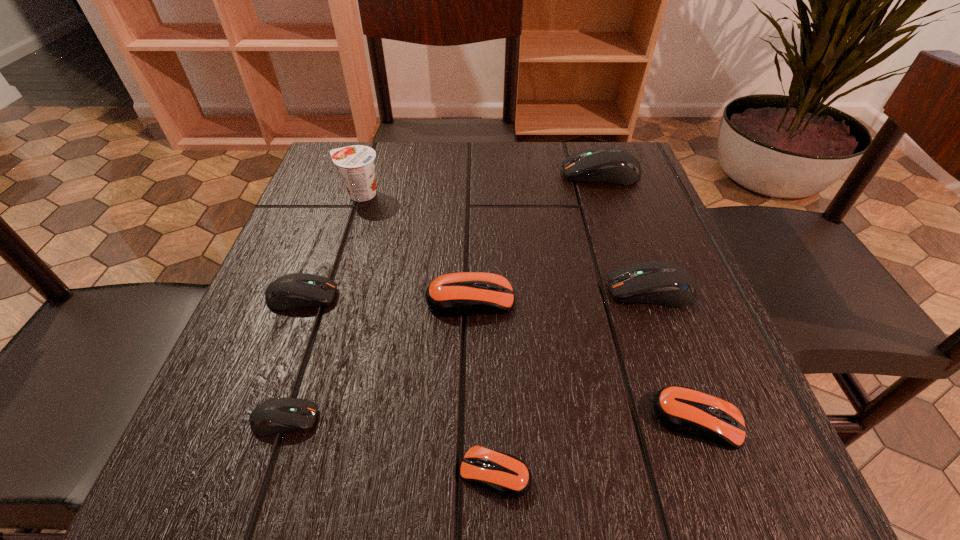
Find the location of a particular element. This screenshot has height=540, width=960. free space located 0.080m on the left of the second smallest orange computer mouse is located at coordinates (594, 420).

The image size is (960, 540). Identify the location of vacant space located 0.300m on the button of the smallest dark computer equipment. (539, 419).

The width and height of the screenshot is (960, 540). What are the coordinates of `vacant area located on the back of the shortest object` in the screenshot? It's located at pyautogui.click(x=493, y=386).

Image resolution: width=960 pixels, height=540 pixels. In order to click on yogurt at the far edge in this screenshot , I will do `click(356, 165)`.

This screenshot has width=960, height=540. I want to click on computer equipment situated at the far edge, so 611,165.

The height and width of the screenshot is (540, 960). What are the coordinates of `yogurt that is at the left edge` in the screenshot? It's located at (356, 165).

Identify the location of object that is at the far left corner. (356, 165).

Locate an element on the screen. The width and height of the screenshot is (960, 540). object present at the near left corner is located at coordinates (284, 414).

Identify the location of object that is at the far right corner. The width and height of the screenshot is (960, 540). (611, 165).

Where is `object that is at the near right corner`? This screenshot has height=540, width=960. object that is at the near right corner is located at coordinates (681, 409).